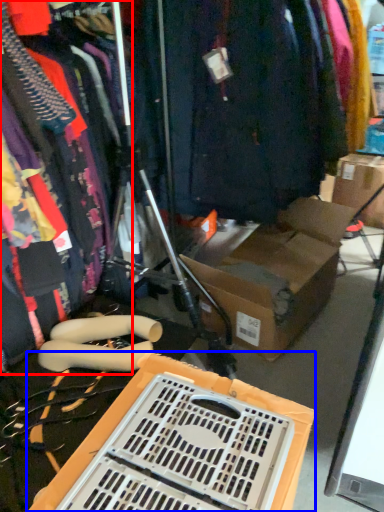
Question: Which object appears farthest to the camera in this image, clothing (highlighted by a red box) or storage box (highlighted by a blue box)?

Choices:
 (A) clothing
 (B) storage box

Answer: (B)